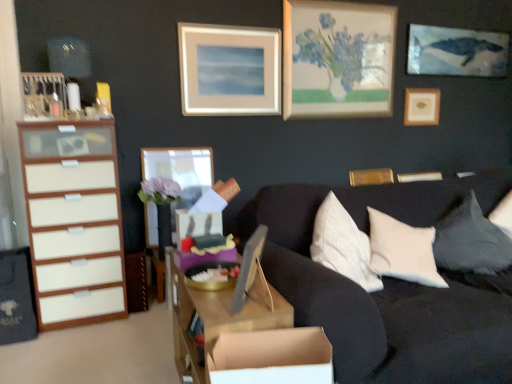
Image resolution: width=512 pixels, height=384 pixels. I want to click on wooden picture frame at center, the third picture frame positioned from the left, so click(x=248, y=267).

Image resolution: width=512 pixels, height=384 pixels. What do you see at coordinates (229, 70) in the screenshot?
I see `matte wooden picture frame at upper center, the third picture frame viewed from the back` at bounding box center [229, 70].

Describe the element at coordinates (371, 177) in the screenshot. I see `gold metallic picture frame at upper right, which is the 4th picture frame in front-to-back order` at that location.

What do you see at coordinates (471, 241) in the screenshot? The image size is (512, 384). I see `dark gray fabric pillow at right` at bounding box center [471, 241].

Locate an element on the screen. The image size is (512, 384). wooden picture frame at center, marked as the 3th picture frame in a right-to-left arrangement is located at coordinates (248, 267).

Consider the image. How different are the orientations of matte wooden picture frame at upper center, which is counted as the fourth picture frame, starting from the right, and gold metallic picture frame at upper right, the 2th picture frame positioned from the right, in degrees?

They differ by 0.266 degrees in their facing directions.

Who is more distant, matte wooden picture frame at upper center, placed as the second picture frame when sorted from left to right, or gold metallic picture frame at upper right, which is the 4th picture frame in front-to-back order?

gold metallic picture frame at upper right, which is the 4th picture frame in front-to-back order.

Is matte wooden picture frame at upper center, marked as the 3th picture frame in a front-to-back arrangement, not inside gold metallic picture frame at upper right, the 2th picture frame positioned from the right?

matte wooden picture frame at upper center, marked as the 3th picture frame in a front-to-back arrangement, is positioned outside gold metallic picture frame at upper right, the 2th picture frame positioned from the right.

Considering the points (245, 270) and (421, 101), which point is behind, point (245, 270) or point (421, 101)?

Positioned behind is point (421, 101).

In the image, is wooden picture frame at center, the third picture frame positioned from the left, positioned in front of or behind wooden picture frame at upper right, the 1th picture frame in the right-to-left sequence?

wooden picture frame at center, the third picture frame positioned from the left, is in front of wooden picture frame at upper right, the 1th picture frame in the right-to-left sequence.

Based on the photo, who is shorter, wooden picture frame at center, the 1th picture frame from the front, or wooden picture frame at upper right, which is the fifth picture frame in front-to-back order?

With less height is wooden picture frame at center, the 1th picture frame from the front.

Does wooden picture frame at center, acting as the 5th picture frame starting from the back, have a smaller size compared to wooden picture frame at upper right, the first picture frame in the back-to-front sequence?

Actually, wooden picture frame at center, acting as the 5th picture frame starting from the back, might be larger than wooden picture frame at upper right, the first picture frame in the back-to-front sequence.

Is gold metallic picture frame at upper right, the 2th picture frame positioned from the right, to the right of wooden picture frame at center, which is the second picture frame from front to back, from the viewer's perspective?

Yes, gold metallic picture frame at upper right, the 2th picture frame positioned from the right, is to the right of wooden picture frame at center, which is the second picture frame from front to back.

Which is in front, point (381, 178) or point (168, 162)?

Point (168, 162)

Is gold metallic picture frame at upper right, which is the 4th picture frame in front-to-back order, bigger than wooden picture frame at center, acting as the fourth picture frame starting from the back?

No, gold metallic picture frame at upper right, which is the 4th picture frame in front-to-back order, is not bigger than wooden picture frame at center, acting as the fourth picture frame starting from the back.

From the picture: Could you tell me if gold metallic picture frame at upper right, the 2th picture frame positioned from the right, is facing wooden picture frame at center, the fifth picture frame from the right?

No, gold metallic picture frame at upper right, the 2th picture frame positioned from the right, is not turned towards wooden picture frame at center, the fifth picture frame from the right.

Which is correct: wooden picture frame at center, which is the second picture frame from front to back, is inside wooden picture frame at center, the 1th picture frame from the front, or outside of it?

wooden picture frame at center, which is the second picture frame from front to back, cannot be found inside wooden picture frame at center, the 1th picture frame from the front.

How distant is wooden picture frame at center, the fifth picture frame from the right, from wooden picture frame at center, the third picture frame positioned from the left?

1.69 meters.

From the image's perspective, which is above, wooden picture frame at center, arranged as the first picture frame when viewed from the left, or wooden picture frame at center, the third picture frame positioned from the left?

wooden picture frame at center, arranged as the first picture frame when viewed from the left, appears higher in the image.

Can you confirm if wooden picture frame at center, which is the second picture frame from front to back, is positioned to the left of wooden picture frame at center, the 1th picture frame from the front?

Indeed, wooden picture frame at center, which is the second picture frame from front to back, is positioned on the left side of wooden picture frame at center, the 1th picture frame from the front.

Looking at this image, from the image's perspective, between matte wooden picture frame at upper center, which is counted as the fourth picture frame, starting from the right, and wooden picture frame at center, the 1th picture frame from the front, which one is located above?

matte wooden picture frame at upper center, which is counted as the fourth picture frame, starting from the right, from the image's perspective.

Is matte wooden picture frame at upper center, marked as the 3th picture frame in a front-to-back arrangement, bigger or smaller than wooden picture frame at center, marked as the 3th picture frame in a right-to-left arrangement?

Clearly, matte wooden picture frame at upper center, marked as the 3th picture frame in a front-to-back arrangement, is larger in size than wooden picture frame at center, marked as the 3th picture frame in a right-to-left arrangement.

Considering the positions of point (224, 29) and point (245, 264), is point (224, 29) closer or farther from the camera than point (245, 264)?

Clearly, point (224, 29) is more distant from the camera than point (245, 264).

From a real-world perspective, is matte wooden picture frame at upper center, marked as the 3th picture frame in a front-to-back arrangement, above or below wooden picture frame at center, marked as the 3th picture frame in a right-to-left arrangement?

matte wooden picture frame at upper center, marked as the 3th picture frame in a front-to-back arrangement, is situated higher than wooden picture frame at center, marked as the 3th picture frame in a right-to-left arrangement, in the real world.

You are a GUI agent. You are given a task and a screenshot of the screen. Output one action in this format:
    pyautogui.click(x=<x>, y=<y>)
    Task: Click on the picture frame that is the 5th object above the cardboard box at lower center (from a real-world perspective)
    This screenshot has width=512, height=384.
    Given the screenshot: What is the action you would take?
    pyautogui.click(x=229, y=70)

From the image's perspective, is matte wooden picture frame at upper center, marked as the 3th picture frame in a front-to-back arrangement, above or below cardboard box at lower center?

matte wooden picture frame at upper center, marked as the 3th picture frame in a front-to-back arrangement, is above cardboard box at lower center.

Looking at the image, does matte wooden picture frame at upper center, which is counted as the fourth picture frame, starting from the right, seem bigger or smaller compared to cardboard box at lower center?

Considering their sizes, matte wooden picture frame at upper center, which is counted as the fourth picture frame, starting from the right, takes up more space than cardboard box at lower center.

Considering the relative sizes of wooden picture frame at upper right, which is the fifth picture frame in front-to-back order, and matte wooden picture frame at upper center, which is counted as the fourth picture frame, starting from the right, in the image provided, is wooden picture frame at upper right, which is the fifth picture frame in front-to-back order, bigger than matte wooden picture frame at upper center, which is counted as the fourth picture frame, starting from the right,?

Incorrect, wooden picture frame at upper right, which is the fifth picture frame in front-to-back order, is not larger than matte wooden picture frame at upper center, which is counted as the fourth picture frame, starting from the right.

Is wooden picture frame at upper right, which is the fifth picture frame in front-to-back order, oriented away from matte wooden picture frame at upper center, which is counted as the fourth picture frame, starting from the right?

wooden picture frame at upper right, which is the fifth picture frame in front-to-back order, is not turned away from matte wooden picture frame at upper center, which is counted as the fourth picture frame, starting from the right.

From a real-world perspective, which picture frame is the 1st one underneath the matte wooden picture frame at upper center, marked as the 3th picture frame in a front-to-back arrangement? Please provide its 2D coordinates.

[(422, 106)]

In the scene shown: Which of these two, wooden picture frame at upper right, the 1th picture frame in the right-to-left sequence, or matte wooden picture frame at upper center, which is counted as the fourth picture frame, starting from the right, stands taller?

With more height is matte wooden picture frame at upper center, which is counted as the fourth picture frame, starting from the right.

Where is `the 2nd picture frame above the gold metallic picture frame at upper right, which is the 4th picture frame in front-to-back order (from the image's perspective)`? This screenshot has width=512, height=384. the 2nd picture frame above the gold metallic picture frame at upper right, which is the 4th picture frame in front-to-back order (from the image's perspective) is located at coordinates (229, 70).

Where is `the 2nd picture frame counting from the right side of the wooden picture frame at center, the third picture frame positioned from the left`? The height and width of the screenshot is (384, 512). the 2nd picture frame counting from the right side of the wooden picture frame at center, the third picture frame positioned from the left is located at coordinates [x=422, y=106].

Looking at the image, which one is located closer to matte wooden picture frame at upper center, marked as the 3th picture frame in a front-to-back arrangement, white wood chest of drawers at left or wooden picture frame at center, the fifth picture frame from the right?

Based on the image, wooden picture frame at center, the fifth picture frame from the right, appears to be nearer to matte wooden picture frame at upper center, marked as the 3th picture frame in a front-to-back arrangement.

Based on their spatial positions, is matte wooden picture frame at upper center, which is counted as the fourth picture frame, starting from the right, or cardboard box at lower center closer to gold metallic picture frame at upper right, which is counted as the second picture frame, starting from the back?

matte wooden picture frame at upper center, which is counted as the fourth picture frame, starting from the right, is positioned closer to the anchor gold metallic picture frame at upper right, which is counted as the second picture frame, starting from the back.

Based on their spatial positions, is dark gray fabric pillow at right or cardboard box at lower center further from wooden picture frame at center, acting as the fourth picture frame starting from the back?

The object further to wooden picture frame at center, acting as the fourth picture frame starting from the back, is cardboard box at lower center.

Based on their spatial positions, is wooden desk at center or matte wooden picture frame at upper center, which is counted as the fourth picture frame, starting from the right, further from wooden picture frame at center, the fifth picture frame from the right?

The object further to wooden picture frame at center, the fifth picture frame from the right, is wooden desk at center.

Looking at this image, which object lies nearer to the anchor point wooden picture frame at center, arranged as the first picture frame when viewed from the left, wooden picture frame at upper right, which is the fifth picture frame in front-to-back order, or wooden desk at center?

wooden desk at center is positioned closer to the anchor wooden picture frame at center, arranged as the first picture frame when viewed from the left.

Considering their positions, is gold metallic picture frame at upper right, positioned as the 4th picture frame in left-to-right order, positioned closer to dark gray fabric pillow at right than wooden picture frame at upper right, the 1th picture frame in the right-to-left sequence?

Among the two, gold metallic picture frame at upper right, positioned as the 4th picture frame in left-to-right order, is located nearer to dark gray fabric pillow at right.

When comparing their distances from matte wooden picture frame at upper center, placed as the second picture frame when sorted from left to right, does dark gray fabric pillow at right or white wood chest of drawers at left seem further?

dark gray fabric pillow at right.

When comparing their distances from wooden picture frame at center, marked as the 3th picture frame in a right-to-left arrangement, does wooden desk at center or cardboard box at lower center seem further?

cardboard box at lower center is further to wooden picture frame at center, marked as the 3th picture frame in a right-to-left arrangement.

Find the location of a particular element. the chest of drawers located between cardboard box at lower center and matte wooden picture frame at upper center, which is counted as the fourth picture frame, starting from the right, in the depth direction is located at coordinates (74, 221).

You are a GUI agent. You are given a task and a screenshot of the screen. Output one action in this format:
    pyautogui.click(x=<x>, y=<y>)
    Task: Click on the desk between cardboard box at lower center and white wood chest of drawers at left along the z-axis
    The width and height of the screenshot is (512, 384).
    Given the screenshot: What is the action you would take?
    click(x=218, y=318)

You are a GUI agent. You are given a task and a screenshot of the screen. Output one action in this format:
    pyautogui.click(x=<x>, y=<y>)
    Task: Click on the picture frame positioned between cardboard box at lower center and wooden picture frame at center, acting as the fourth picture frame starting from the back, from near to far
    Image resolution: width=512 pixels, height=384 pixels.
    Given the screenshot: What is the action you would take?
    pyautogui.click(x=248, y=267)

Identify the location of desk located between white wood chest of drawers at left and wooden picture frame at center, acting as the 5th picture frame starting from the back, in the left-right direction. The width and height of the screenshot is (512, 384). (218, 318).